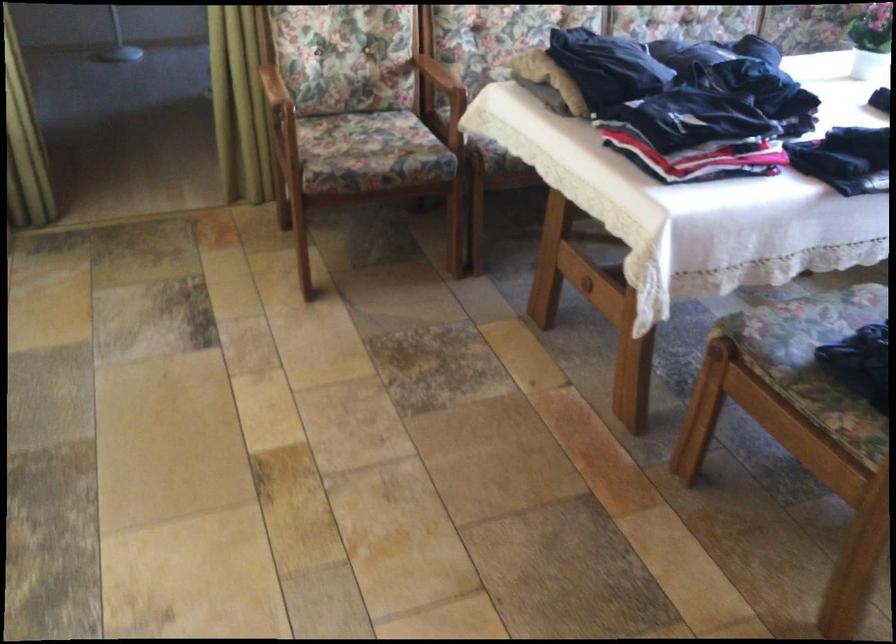
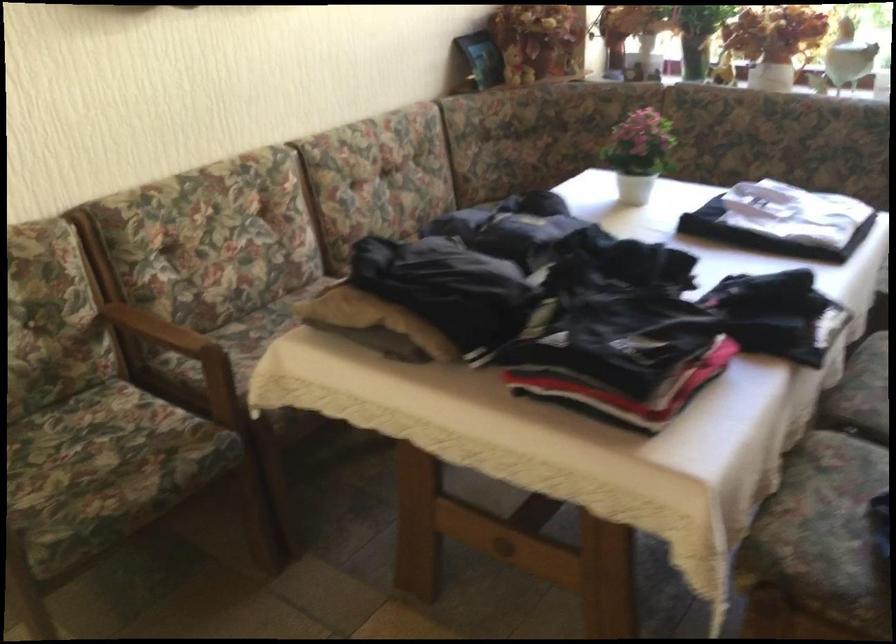
Locate, in the second image, the point that corresponds to the point at 431,73 in the first image.

(158, 328)